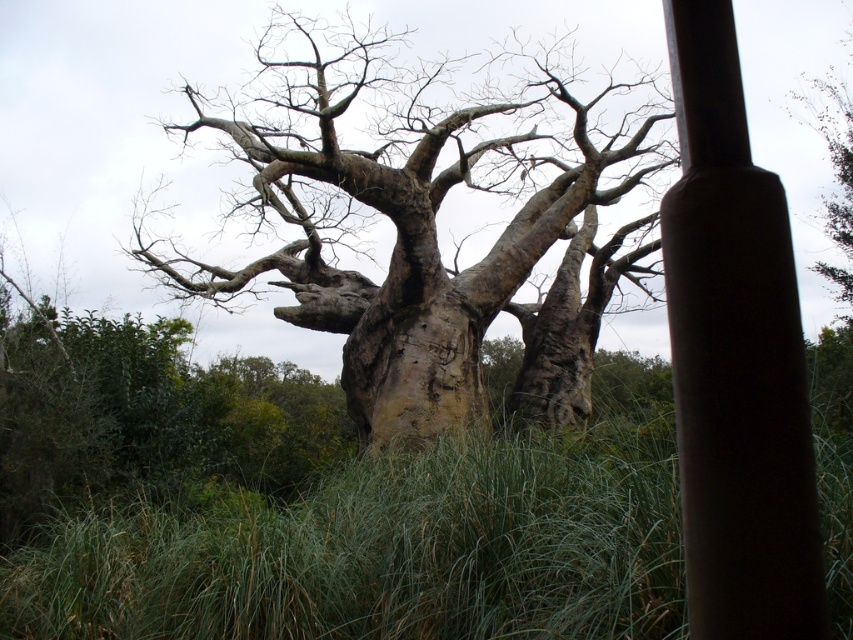
You are standing at the base of the large ancient tree with thick, gnarled trunk and sprawling branches. You notice a point marked at coordinates [433,237]. What type of bark texture does the tree have at that specific point?

The point at [433,237] corresponds to smooth bark tree at center, so the bark texture at that point is smooth.